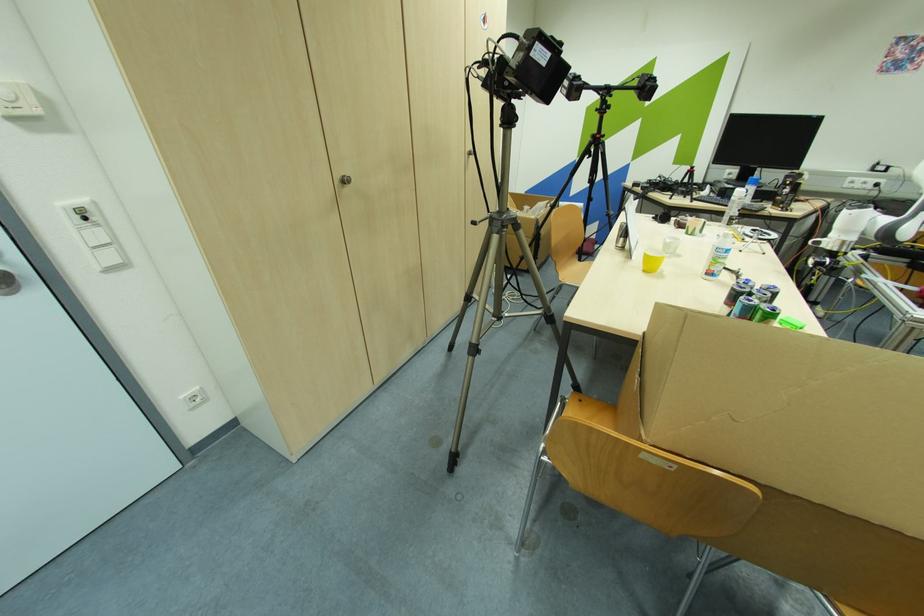
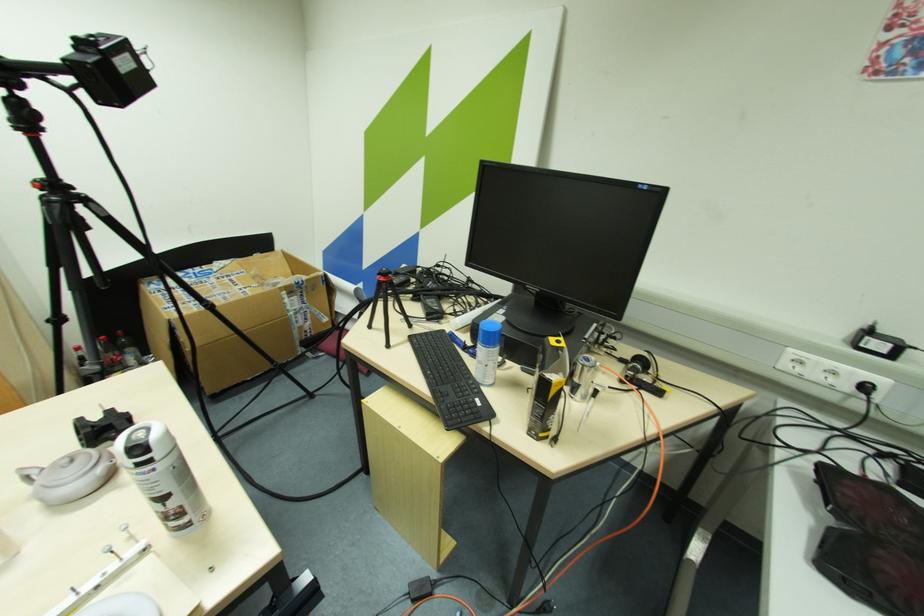
Question: I am providing you with two images of the same scene from different viewpoints. Please identify which objects are invisible in image2.

Choices:
 (A) white spray can
 (B) black computer keyboard
 (C) chair sitting surface
 (D) red document holder

Answer: (C)